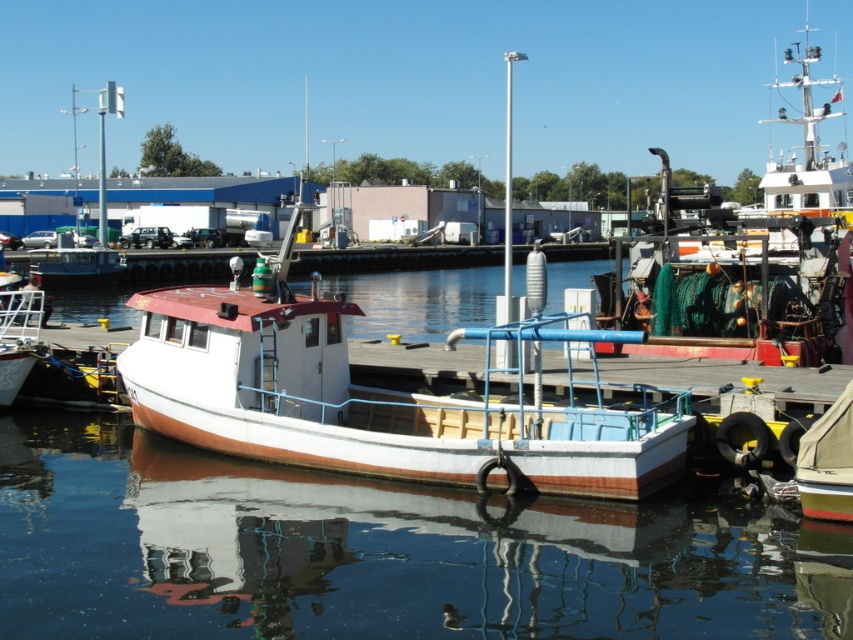
Question: Can you confirm if transparent water at center is thinner than yellow rubber dinghy at lower right?

Choices:
 (A) no
 (B) yes

Answer: (A)

Question: Is transparent water at center positioned in front of yellow rubber dinghy at lower right?

Choices:
 (A) no
 (B) yes

Answer: (B)

Question: Estimate the real-world distances between objects in this image. Which object is closer to the transparent water at center?

Choices:
 (A) yellow rubber dinghy at lower right
 (B) white painted wood boat at center

Answer: (B)

Question: Which object appears closest to the camera in this image?

Choices:
 (A) white painted wood boat at center
 (B) yellow rubber dinghy at lower right
 (C) transparent water at center

Answer: (C)

Question: Can you confirm if transparent water at center is bigger than yellow rubber dinghy at lower right?

Choices:
 (A) yes
 (B) no

Answer: (A)

Question: Which of the following is the closest to the observer?

Choices:
 (A) white painted wood boat at center
 (B) yellow rubber dinghy at lower right
 (C) transparent water at center

Answer: (C)